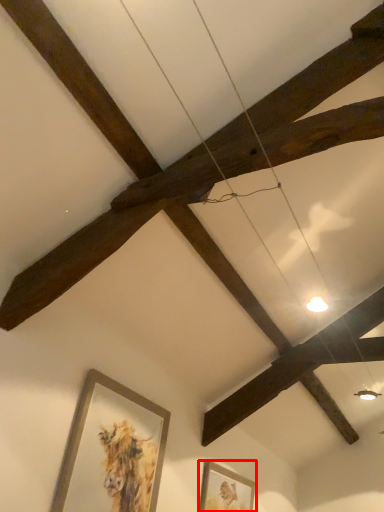
Question: Where is picture frame (annotated by the red box) located in relation to picture frame in the image?

Choices:
 (A) right
 (B) left

Answer: (A)